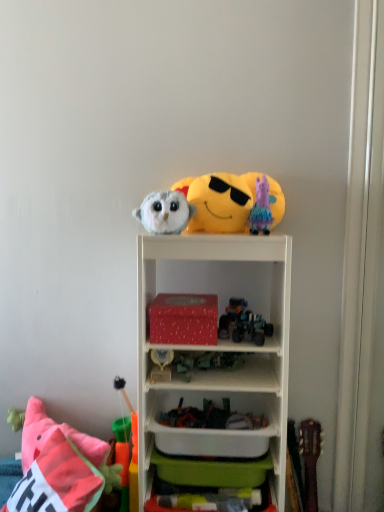
This screenshot has width=384, height=512. I want to click on red matte box at center, so pyautogui.click(x=183, y=319).

Identify the location of shiny metallic robot at center, placed as the 4th toy when sorted from top to bottom. (231, 316).

In order to face black plastic toy at lower left, the second toy positioned from the bottom, should I rotate leftwards or rightwards?

Turn left approximately 9.022 degrees to face it.

Find the location of a particular element. This screenshot has width=384, height=512. fluffy white owl at upper center, which is the sixth toy in bottom-to-top order is located at coordinates (165, 212).

Looking at this image, from the image's perspective, is shiny metallic robot at center, placed as the 4th toy when sorted from top to bottom, located beneath green plastic toy at center, which ranks as the third toy in bottom-to-top order?

Incorrect, from the image's perspective, shiny metallic robot at center, placed as the 4th toy when sorted from top to bottom, is higher than green plastic toy at center, which ranks as the third toy in bottom-to-top order.

Is shiny metallic robot at center, placed as the 4th toy when sorted from top to bottom, turned away from green plastic toy at center, which ranks as the third toy in bottom-to-top order?

No.

Based on the photo, which of these two, shiny metallic robot at center, positioned as the 5th toy in bottom-to-top order, or green plastic toy at center, which ranks as the third toy in bottom-to-top order, stands taller?

shiny metallic robot at center, positioned as the 5th toy in bottom-to-top order, is taller.

Is the surface of shiny metallic robot at center, positioned as the 5th toy in bottom-to-top order, in direct contact with green plastic toy at center, which ranks as the third toy in bottom-to-top order?

No, shiny metallic robot at center, positioned as the 5th toy in bottom-to-top order, is not making contact with green plastic toy at center, which ranks as the third toy in bottom-to-top order.

Which object is positioned more to the left, green plastic toy at center, which ranks as the third toy in bottom-to-top order, or shiny metallic robot at center, positioned as the 5th toy in bottom-to-top order?

Positioned to the left is green plastic toy at center, which ranks as the third toy in bottom-to-top order.

How much distance is there between green plastic toy at center, marked as the sixth toy in a top-to-bottom arrangement, and shiny metallic robot at center, placed as the 4th toy when sorted from top to bottom?

green plastic toy at center, marked as the sixth toy in a top-to-bottom arrangement, is 6.17 inches away from shiny metallic robot at center, placed as the 4th toy when sorted from top to bottom.

What's the angular difference between green plastic toy at center, marked as the sixth toy in a top-to-bottom arrangement, and shiny metallic robot at center, placed as the 4th toy when sorted from top to bottom,'s facing directions?

They differ by 0.384 degrees in their facing directions.

From the image's perspective, which is below, green plastic toy at center, marked as the sixth toy in a top-to-bottom arrangement, or shiny metallic robot at center, positioned as the 5th toy in bottom-to-top order?

From the image's view, green plastic toy at center, marked as the sixth toy in a top-to-bottom arrangement, is below.

Considering the points (230, 438) and (159, 369), which point is in front, point (230, 438) or point (159, 369)?

The point (230, 438) is in front.

Is white plastic container at center facing towards green plastic toy at center, marked as the sixth toy in a top-to-bottom arrangement?

No, white plastic container at center is not aimed at green plastic toy at center, marked as the sixth toy in a top-to-bottom arrangement.

Looking at their sizes, would you say white plastic container at center is wider or thinner than green plastic toy at center, marked as the sixth toy in a top-to-bottom arrangement?

white plastic container at center is wider than green plastic toy at center, marked as the sixth toy in a top-to-bottom arrangement.

Between pink fabric unicorn at upper right, which appears as the 7th toy when ordered from the bottom, and shiny metallic robot at center, positioned as the 5th toy in bottom-to-top order, which one appears on the left side from the viewer's perspective?

From the viewer's perspective, shiny metallic robot at center, positioned as the 5th toy in bottom-to-top order, appears more on the left side.

Between pink fabric unicorn at upper right, which appears as the 7th toy when ordered from the bottom, and shiny metallic robot at center, positioned as the 5th toy in bottom-to-top order, which one is positioned in front?

pink fabric unicorn at upper right, which appears as the 7th toy when ordered from the bottom, is in front.

Can you tell me how much pink fabric unicorn at upper right, the second toy when ordered from top to bottom, and shiny metallic robot at center, placed as the 4th toy when sorted from top to bottom, differ in facing direction?

pink fabric unicorn at upper right, the second toy when ordered from top to bottom, and shiny metallic robot at center, placed as the 4th toy when sorted from top to bottom, are facing 1.51 degrees away from each other.

In the scene shown: Between pink fabric unicorn at upper right, which appears as the 7th toy when ordered from the bottom, and shiny metallic robot at center, positioned as the 5th toy in bottom-to-top order, which one has smaller size?

Smaller between the two is pink fabric unicorn at upper right, which appears as the 7th toy when ordered from the bottom.

Is fluffy pink pillow at lower left facing towards yellow plush emoji at upper center, which is the 1th toy in top-to-bottom order?

No, fluffy pink pillow at lower left is not aimed at yellow plush emoji at upper center, which is the 1th toy in top-to-bottom order.

Are fluffy pink pillow at lower left and yellow plush emoji at upper center, positioned as the 8th toy in bottom-to-top order, far apart?

No, fluffy pink pillow at lower left is in close proximity to yellow plush emoji at upper center, positioned as the 8th toy in bottom-to-top order.

From a real-world perspective, is fluffy pink pillow at lower left positioned above or below yellow plush emoji at upper center, which is the 1th toy in top-to-bottom order?

Clearly, from a real-world perspective, fluffy pink pillow at lower left is below yellow plush emoji at upper center, which is the 1th toy in top-to-bottom order.

In the scene shown: What's the angular difference between fluffy pink pillow at lower left and yellow plush emoji at upper center, which is the 1th toy in top-to-bottom order,'s facing directions?

There is a 50.6-degree angle between the facing directions of fluffy pink pillow at lower left and yellow plush emoji at upper center, which is the 1th toy in top-to-bottom order.

Can you confirm if white plastic container at center is shorter than green plastic cup at lower left, which appears as the eighth toy when viewed from the top?

Yes, white plastic container at center is shorter than green plastic cup at lower left, which appears as the eighth toy when viewed from the top.

Can you confirm if white plastic container at center is smaller than green plastic cup at lower left, which appears as the eighth toy when viewed from the top?

Incorrect, white plastic container at center is not smaller in size than green plastic cup at lower left, which appears as the eighth toy when viewed from the top.

Is white plastic container at center not inside green plastic cup at lower left, which appears as the eighth toy when viewed from the top?

Indeed, white plastic container at center is completely outside green plastic cup at lower left, which appears as the eighth toy when viewed from the top.

Is there a large distance between fluffy pink pillow at lower left and shiny metallic robot at center, positioned as the 5th toy in bottom-to-top order?

No, fluffy pink pillow at lower left is in close proximity to shiny metallic robot at center, positioned as the 5th toy in bottom-to-top order.

From a real-world perspective, does fluffy pink pillow at lower left stand above shiny metallic robot at center, placed as the 4th toy when sorted from top to bottom?

No, from a real-world perspective, fluffy pink pillow at lower left is not on top of shiny metallic robot at center, placed as the 4th toy when sorted from top to bottom.

From the image's perspective, is fluffy pink pillow at lower left located above shiny metallic robot at center, positioned as the 5th toy in bottom-to-top order?

No, from the image's perspective, fluffy pink pillow at lower left is not above shiny metallic robot at center, positioned as the 5th toy in bottom-to-top order.

Would you say fluffy pink pillow at lower left is outside shiny metallic robot at center, positioned as the 5th toy in bottom-to-top order?

That's correct, fluffy pink pillow at lower left is outside of shiny metallic robot at center, positioned as the 5th toy in bottom-to-top order.

Locate an element on the screen. toy that is the 2nd one above the green plastic toy at center, which ranks as the third toy in bottom-to-top order (from a real-world perspective) is located at coordinates (231, 316).

From the shiny metallic robot at center, placed as the 4th toy when sorted from top to bottom, count 2nd toys forward and point to it. Please provide its 2D coordinates.

[(202, 361)]

From the image, which object appears to be nearer to green plastic cup at lower left, which ranks as the 1th toy in bottom-to-top order, black plastic toy at lower left, the second toy positioned from the bottom, or fluffy white owl at upper center, which is the sixth toy in bottom-to-top order?

Among the two, black plastic toy at lower left, the second toy positioned from the bottom, is located nearer to green plastic cup at lower left, which ranks as the 1th toy in bottom-to-top order.

From the image, which object appears to be nearer to shiny metallic robot at center, positioned as the 5th toy in bottom-to-top order, yellow plush emoji at upper center, which is the 1th toy in top-to-bottom order, or white plastic shelf at upper center?

The object closer to shiny metallic robot at center, positioned as the 5th toy in bottom-to-top order, is white plastic shelf at upper center.

Estimate the real-world distances between objects in this image. Which object is further from fluffy pink pillow at lower left, black plastic toy at lower left, the second toy positioned from the bottom, or yellow plush emoji at upper center, which is the 1th toy in top-to-bottom order?

Based on the image, yellow plush emoji at upper center, which is the 1th toy in top-to-bottom order, appears to be further to fluffy pink pillow at lower left.

Based on their spatial positions, is green plastic toy at center, which ranks as the third toy in bottom-to-top order, or shiny metallic car at center, which is the 4th toy from bottom to top, further from shiny metallic robot at center, positioned as the 5th toy in bottom-to-top order?

Among the two, green plastic toy at center, which ranks as the third toy in bottom-to-top order, is located further to shiny metallic robot at center, positioned as the 5th toy in bottom-to-top order.

Estimate the real-world distances between objects in this image. Which object is further from yellow plush emoji at upper center, positioned as the 8th toy in bottom-to-top order, fluffy white owl at upper center, the 3th toy viewed from the top, or pink fabric unicorn at upper right, the second toy when ordered from top to bottom?

fluffy white owl at upper center, the 3th toy viewed from the top.

From the image, which object appears to be nearer to red matte box at center, fluffy pink pillow at lower left or pink fabric unicorn at upper right, the second toy when ordered from top to bottom?

The object closer to red matte box at center is pink fabric unicorn at upper right, the second toy when ordered from top to bottom.

Estimate the real-world distances between objects in this image. Which object is further from shiny metallic robot at center, placed as the 4th toy when sorted from top to bottom, white plastic shelf at upper center or fluffy pink pillow at lower left?

fluffy pink pillow at lower left is further to shiny metallic robot at center, placed as the 4th toy when sorted from top to bottom.

Based on their spatial positions, is shiny metallic robot at center, placed as the 4th toy when sorted from top to bottom, or yellow plush emoji at upper center, which is the 1th toy in top-to-bottom order, further from green plastic toy at center, marked as the sixth toy in a top-to-bottom arrangement?

Among the two, yellow plush emoji at upper center, which is the 1th toy in top-to-bottom order, is located further to green plastic toy at center, marked as the sixth toy in a top-to-bottom arrangement.

Image resolution: width=384 pixels, height=512 pixels. I want to click on cabinet between green plastic cup at lower left, which appears as the eighth toy when viewed from the top, and white plastic shelf at upper center from left to right, so click(x=212, y=441).

Identify the location of shelf located between black plastic toy at lower left, the second toy positioned from the bottom, and shiny metallic car at center, the fifth toy when ordered from top to bottom, in the left-right direction. This screenshot has width=384, height=512. (218, 348).

Locate an element on the screen. shelf that lies between fluffy white owl at upper center, which is the sixth toy in bottom-to-top order, and green plastic cup at lower left, which ranks as the 1th toy in bottom-to-top order, from top to bottom is located at coordinates (218, 348).

What are the coordinates of `storage box between fluffy white owl at upper center, which is the sixth toy in bottom-to-top order, and white plastic shelf at upper center vertically` in the screenshot? It's located at (183, 319).